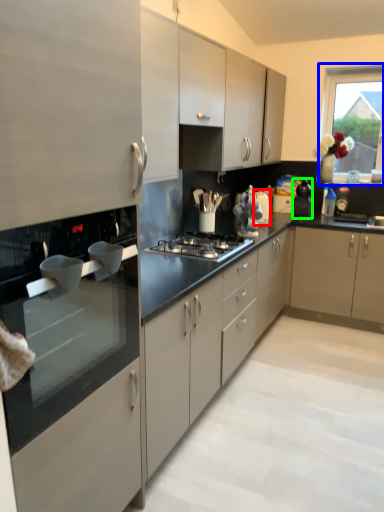
Question: Which is farther away from appliance (highlighted by a red box)? window (highlighted by a blue box) or kitchen appliance (highlighted by a green box)?

Choices:
 (A) window
 (B) kitchen appliance

Answer: (A)